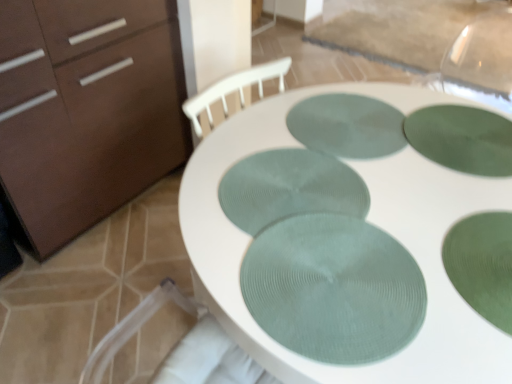
At what (x,y) coordinates should I click in order to perform the action: click on vacant space that is in between green textured glass plate at upper right, placed as the 2th glass plate when sorted from back to front, and green textured glass plate at center, placed as the fifth glass plate when sorted from back to front. Please return your answer as a coordinate pair (x, y). Looking at the image, I should click on point(406,201).